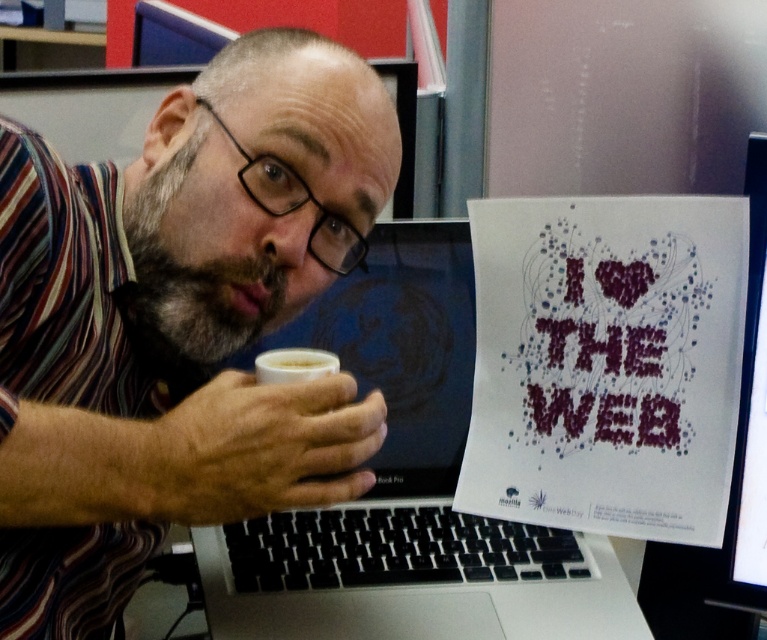
Question: Which point is closer to the camera?

Choices:
 (A) (568, 534)
 (B) (272, 368)
 (C) (710, 307)
 (D) (285, 381)

Answer: (D)

Question: In this image, where is striped fabric shirt at center located relative to white frothy foam at upper center?

Choices:
 (A) left
 (B) right

Answer: (A)

Question: Which object is closer to the camera taking this photo?

Choices:
 (A) striped fabric shirt at center
 (B) white frothy beverage at lower center
 (C) white frothy foam at upper center
 (D) white paper poster at center

Answer: (A)

Question: Which of the following is the farthest from the observer?

Choices:
 (A) (696, 305)
 (B) (209, 314)
 (C) (308, 365)
 (D) (321, 529)

Answer: (D)

Question: Does striped fabric shirt at center appear over white paper poster at center?

Choices:
 (A) no
 (B) yes

Answer: (B)

Question: Can you confirm if white paper poster at center is positioned above white frothy foam at upper center?

Choices:
 (A) no
 (B) yes

Answer: (A)